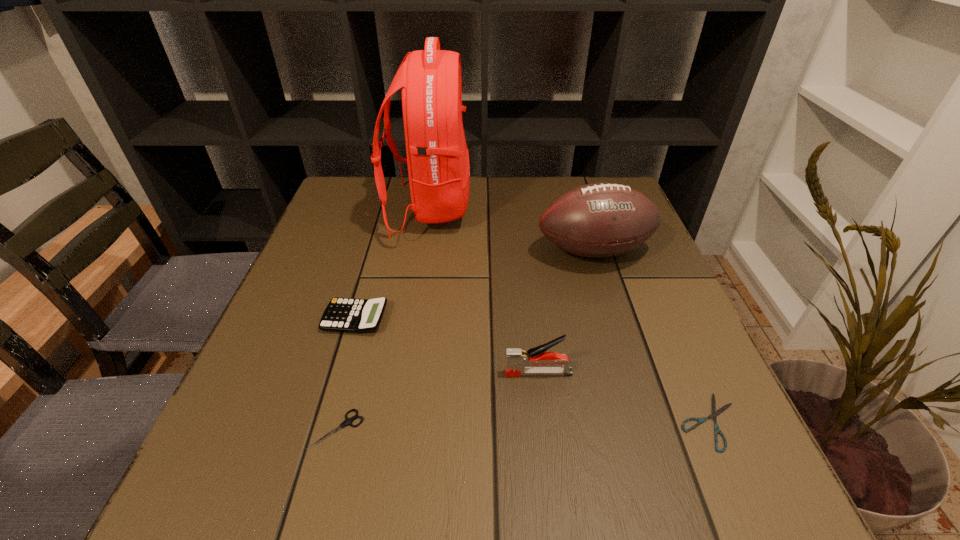
Find the location of a particular element. Image resolution: width=960 pixels, height=540 pixels. backpack is located at coordinates (438, 163).

Find the location of a particular element. This screenshot has height=540, width=960. the second tallest object is located at coordinates (597, 220).

Where is `the third tallest object`? The height and width of the screenshot is (540, 960). the third tallest object is located at coordinates (516, 359).

The image size is (960, 540). Find the location of `the fourth farthest object`. the fourth farthest object is located at coordinates (516, 359).

The height and width of the screenshot is (540, 960). In order to click on calculator in this screenshot , I will do click(341, 314).

At what (x,y) coordinates should I click in order to perform the action: click on the third shortest object. Please return your answer as a coordinate pair (x, y). The height and width of the screenshot is (540, 960). Looking at the image, I should click on (341, 314).

At what (x,y) coordinates should I click in order to perform the action: click on the second shortest object. Please return your answer as a coordinate pair (x, y). Looking at the image, I should click on (347, 421).

Find the location of a particular element. This screenshot has width=960, height=540. the left shears is located at coordinates (347, 421).

Image resolution: width=960 pixels, height=540 pixels. Identify the location of the shortest object. (715, 413).

Where is `the shorter shears`? The height and width of the screenshot is (540, 960). the shorter shears is located at coordinates (715, 413).